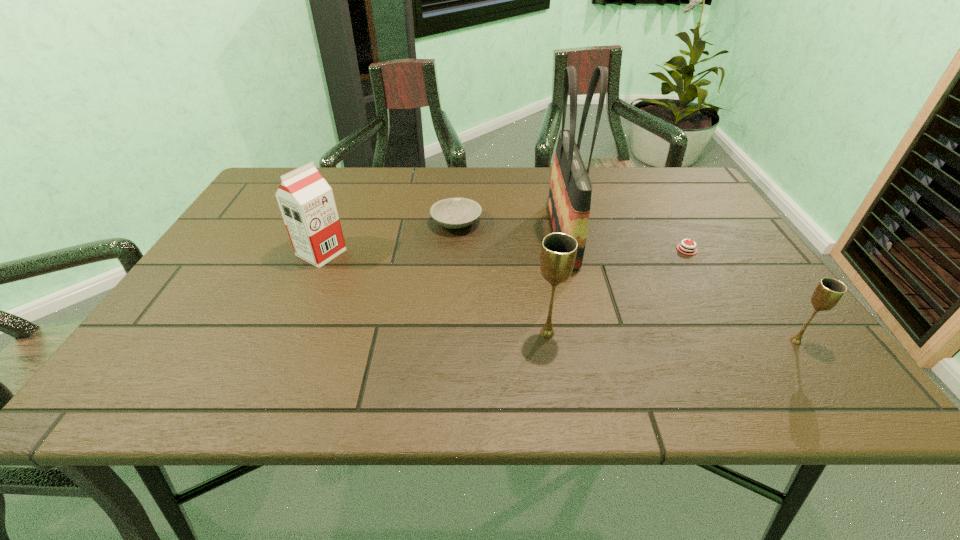
Find the location of a particular element. This screenshot has width=960, height=540. bowl is located at coordinates (453, 213).

At what (x,y) coordinates should I click in order to perform the action: click on blank area located 0.090m on the back of the left chalice. Please return your answer as a coordinate pair (x, y). Looking at the image, I should click on (541, 292).

Where is `vacant space situated 0.240m on the left of the fourth tallest object`? vacant space situated 0.240m on the left of the fourth tallest object is located at coordinates (663, 341).

You are a GUI agent. You are given a task and a screenshot of the screen. Output one action in this format:
    pyautogui.click(x=<x>, y=<y>)
    Task: Click on the free region located on the front-facing side of the shopping bag
    This screenshot has width=960, height=540.
    Given the screenshot: What is the action you would take?
    pyautogui.click(x=432, y=234)

You are a GUI agent. You are given a task and a screenshot of the screen. Output one action in this format:
    pyautogui.click(x=<x>, y=<y>)
    Task: Click on the vacant area located 0.190m on the front-facing side of the shopping bag
    The image size is (960, 540).
    Given the screenshot: What is the action you would take?
    pyautogui.click(x=474, y=234)

Image resolution: width=960 pixels, height=540 pixels. What are the coordinates of `vacant point located 0.230m on the front-facing side of the shopping bag` in the screenshot? It's located at (459, 234).

Locate an element on the screen. Image resolution: width=960 pixels, height=540 pixels. free spot located on the front of the soya milk is located at coordinates (305, 288).

Locate an element on the screen. vacant space positioned 0.210m on the front of the shortest object is located at coordinates (733, 330).

The width and height of the screenshot is (960, 540). Identify the location of free space located 0.180m on the left of the bowl. (364, 223).

Where is `object positioned at the far edge`? This screenshot has width=960, height=540. object positioned at the far edge is located at coordinates (569, 202).